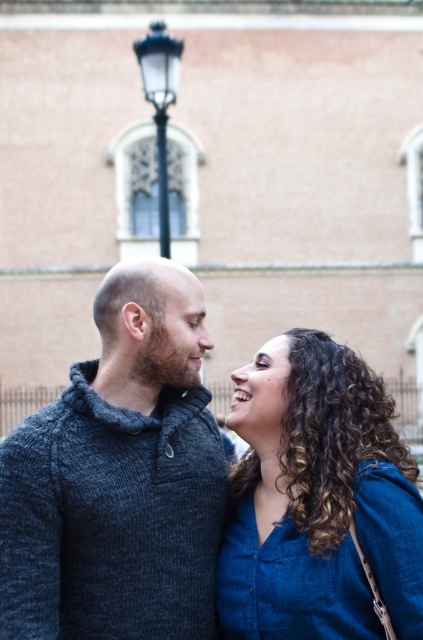
Can you confirm if dark gray knitted sweater at center is positioned above black glass lamp post at upper center?

No.

Which of these two, dark gray knitted sweater at center or black glass lamp post at upper center, stands taller?

black glass lamp post at upper center is taller.

Is point (129, 333) positioned after point (162, 52)?

No, it is not.

You are a GUI agent. You are given a task and a screenshot of the screen. Output one action in this format:
    pyautogui.click(x=<x>, y=<y>)
    Task: Click on the dark gray knitted sweater at center
    
    Given the screenshot: What is the action you would take?
    pyautogui.click(x=118, y=477)

Who is higher up, dark gray knitted sweater at center or blue denim shirt at lower right?

Positioned higher is dark gray knitted sweater at center.

Between dark gray knitted sweater at center and blue denim shirt at lower right, which one has less height?

blue denim shirt at lower right is shorter.

Find the location of a particular element. dark gray knitted sweater at center is located at coordinates (118, 477).

Between blue denim shirt at lower right and black glass lamp post at upper center, which one appears on the right side from the viewer's perspective?

From the viewer's perspective, blue denim shirt at lower right appears more on the right side.

Based on the photo, is blue denim shirt at lower right positioned behind black glass lamp post at upper center?

No, it is in front of black glass lamp post at upper center.

Does point (318, 609) come closer to viewer compared to point (143, 52)?

That is True.

Image resolution: width=423 pixels, height=640 pixels. In order to click on blue denim shirt at lower right in this screenshot , I will do pos(318,500).